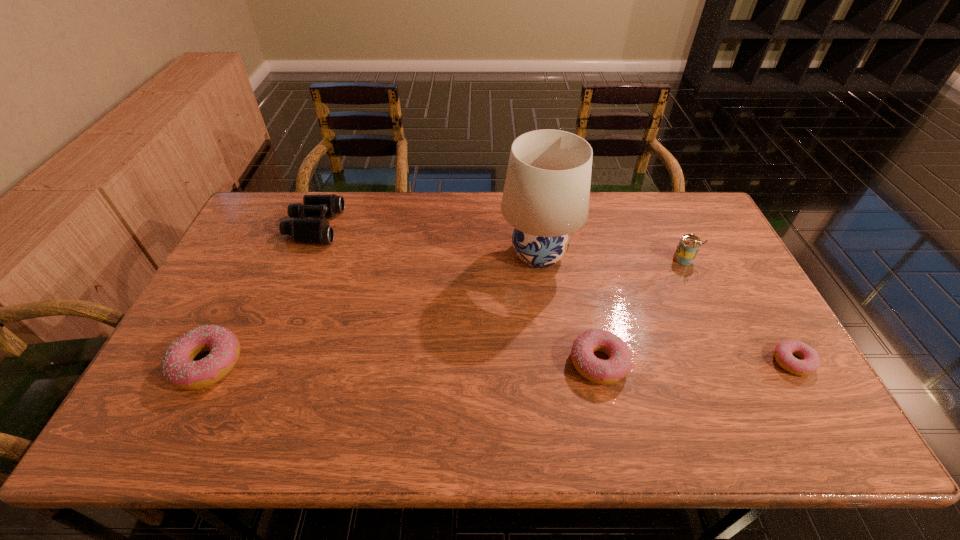
Please point a spot to place another doughnut for symmetrical spacing. Please provide its 2D coordinates. Your answer should be formatted as a tuple, i.e. [(x, y)], where the tuple contains the x and y coordinates of a point satisfying the conditions above.

[(403, 363)]